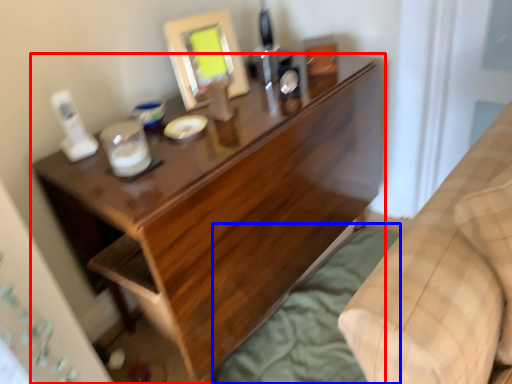
Question: Which point is closer to the camera, desk (highlighted by a red box) or sheet (highlighted by a blue box)?

Choices:
 (A) desk
 (B) sheet

Answer: (A)